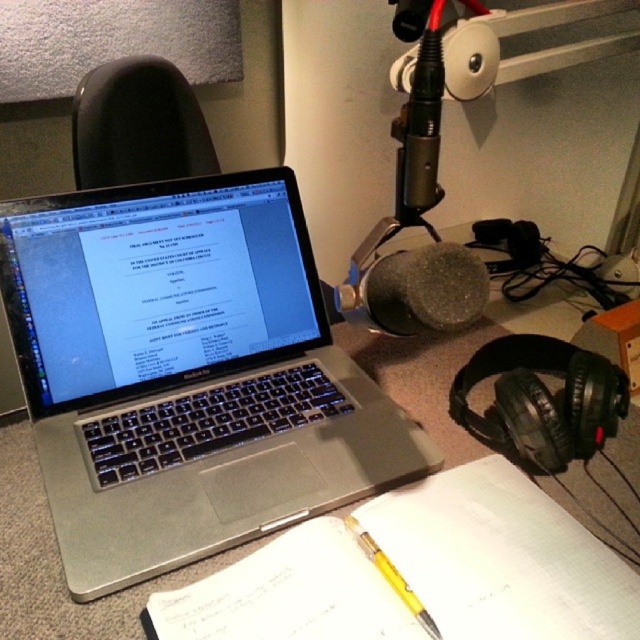
You are organizing your desk and need to place both the black matte headphones at right and the yellow translucent pencil at center into a drawer. The drawer has a width of 15 cm. If the pencil is 12 cm long, can both items fit side by side in the drawer without overlapping?

The black matte headphones at right is larger than the yellow translucent pencil at center. Since the pencil is 12 cm long and the headphones are bigger, their combined width might exceed the 15 cm drawer space. It is unlikely they can fit side by side without overlapping.

You are organizing your desk and want to place a new item between the silver metallic laptop at center and the white paper at center. Considering their heights, which object should you place the item on top of to ensure it is visible above both?

The silver metallic laptop at center is taller than the white paper at center, so placing the item on top of the silver metallic laptop at center would ensure it is visible above both.